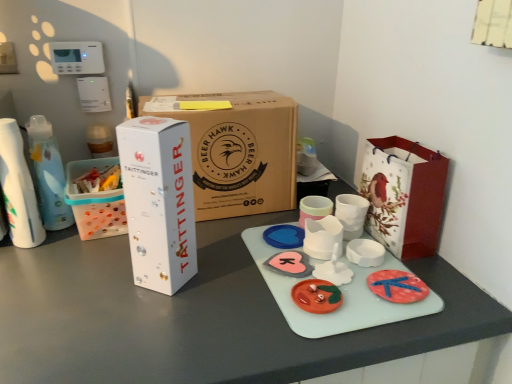
Locate an element on the screen. The width and height of the screenshot is (512, 384). vacant space that is to the left of white glossy box at left, marked as the 1th box in a front-to-back arrangement is located at coordinates (81, 283).